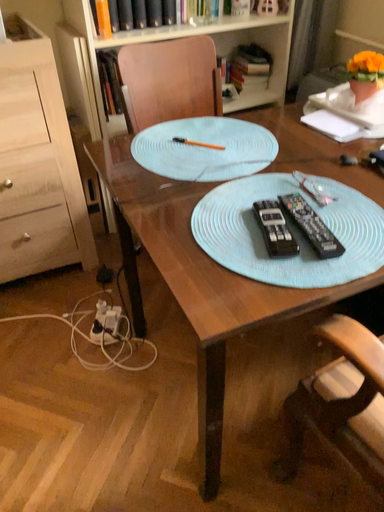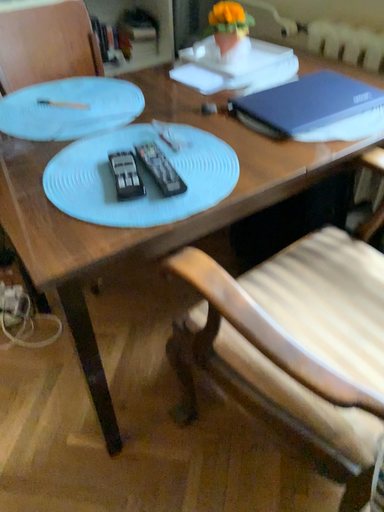
Question: Which way did the camera rotate in the video?

Choices:
 (A) rotated right
 (B) rotated left

Answer: (A)